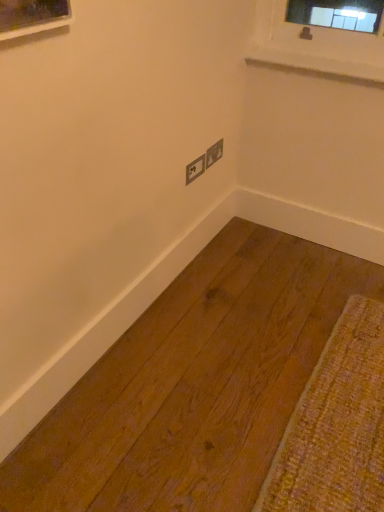
Find the location of a particular element. The width and height of the screenshot is (384, 512). white smooth window sill at upper right is located at coordinates coord(315,64).

You are a GUI agent. You are given a task and a screenshot of the screen. Output one action in this format:
    pyautogui.click(x=<x>, y=<y>)
    Task: Click on the matte gray electrical outlet at center, the first electric outlet positioned from the right
    The height and width of the screenshot is (512, 384).
    Given the screenshot: What is the action you would take?
    pyautogui.click(x=214, y=153)

What is the approximate height of matte gray electrical outlet at center, the first electric outlet positioned from the right?

The height of matte gray electrical outlet at center, the first electric outlet positioned from the right, is 4.01 inches.

Measure the distance between point (187,184) and camera.

Point (187,184) is 5.55 feet from camera.

Identify the location of white smooth window sill at upper right. The width and height of the screenshot is (384, 512). (315, 64).

Is matte gray electric outlet at center, arranged as the second electric outlet when viewed from the right, further to camera compared to white smooth window sill at upper right?

Yes, matte gray electric outlet at center, arranged as the second electric outlet when viewed from the right, is further from the viewer.

From the image's perspective, is matte gray electric outlet at center, arranged as the second electric outlet when viewed from the right, positioned above or below white smooth window sill at upper right?

Clearly, from the image's perspective, matte gray electric outlet at center, arranged as the second electric outlet when viewed from the right, is below white smooth window sill at upper right.

Does point (202, 167) come farther from viewer compared to point (381, 67)?

Yes, it is.

Which of these two, matte gray electric outlet at center, the 1th electric outlet from the left, or white smooth window sill at upper right, is wider?

Wider between the two is white smooth window sill at upper right.

Is white smooth window sill at upper right turned away from matte gray electric outlet at center, arranged as the second electric outlet when viewed from the right?

No, matte gray electric outlet at center, arranged as the second electric outlet when viewed from the right, is not at the back of white smooth window sill at upper right.

Which of these two, white smooth window sill at upper right or matte gray electric outlet at center, arranged as the second electric outlet when viewed from the right, is bigger?

Bigger between the two is white smooth window sill at upper right.

Between white smooth window sill at upper right and matte gray electric outlet at center, arranged as the second electric outlet when viewed from the right, which one has smaller width?

matte gray electric outlet at center, arranged as the second electric outlet when viewed from the right, is thinner.

Is white smooth window sill at upper right surrounding matte gray electric outlet at center, the 1th electric outlet from the left?

No, matte gray electric outlet at center, the 1th electric outlet from the left, is located outside of white smooth window sill at upper right.

Is matte gray electric outlet at center, the 1th electric outlet from the left, placed right next to matte gray electrical outlet at center, acting as the second electric outlet starting from the left?

Yes, matte gray electric outlet at center, the 1th electric outlet from the left, is beside matte gray electrical outlet at center, acting as the second electric outlet starting from the left.

From the image's perspective, is matte gray electric outlet at center, arranged as the second electric outlet when viewed from the right, below matte gray electrical outlet at center, the first electric outlet positioned from the right?

Yes.

Is matte gray electric outlet at center, the 1th electric outlet from the left, surrounding matte gray electrical outlet at center, acting as the second electric outlet starting from the left?

No.

Which is behind, matte gray electric outlet at center, arranged as the second electric outlet when viewed from the right, or matte gray electrical outlet at center, the first electric outlet positioned from the right?

matte gray electrical outlet at center, the first electric outlet positioned from the right, is behind.

Can you confirm if matte gray electrical outlet at center, the first electric outlet positioned from the right, is smaller than matte gray electric outlet at center, the 1th electric outlet from the left?

Yes, matte gray electrical outlet at center, the first electric outlet positioned from the right, is smaller than matte gray electric outlet at center, the 1th electric outlet from the left.

Is matte gray electric outlet at center, arranged as the second electric outlet when viewed from the right, at the back of matte gray electrical outlet at center, acting as the second electric outlet starting from the left?

matte gray electrical outlet at center, acting as the second electric outlet starting from the left, does not have its back to matte gray electric outlet at center, arranged as the second electric outlet when viewed from the right.

From a real-world perspective, is matte gray electrical outlet at center, the first electric outlet positioned from the right, above or below matte gray electric outlet at center, the 1th electric outlet from the left?

From a real-world perspective, matte gray electrical outlet at center, the first electric outlet positioned from the right, is physically above matte gray electric outlet at center, the 1th electric outlet from the left.

Is point (211, 165) in front of point (200, 168)?

No, (211, 165) is behind (200, 168).

Is white smooth window sill at upper right facing away from matte gray electrical outlet at center, acting as the second electric outlet starting from the left?

No, white smooth window sill at upper right is not facing the opposite direction of matte gray electrical outlet at center, acting as the second electric outlet starting from the left.

Is white smooth window sill at upper right situated inside matte gray electrical outlet at center, the first electric outlet positioned from the right, or outside?

white smooth window sill at upper right is not enclosed by matte gray electrical outlet at center, the first electric outlet positioned from the right.

Considering the sizes of objects white smooth window sill at upper right and matte gray electrical outlet at center, the first electric outlet positioned from the right, in the image provided, who is shorter, white smooth window sill at upper right or matte gray electrical outlet at center, the first electric outlet positioned from the right,?

white smooth window sill at upper right.

Is the surface of white smooth window sill at upper right in direct contact with matte gray electrical outlet at center, the first electric outlet positioned from the right?

They are not placed beside each other.

Can you tell me how much matte gray electrical outlet at center, the first electric outlet positioned from the right, and white smooth window sill at upper right differ in facing direction?

92.2 degrees separate the facing orientations of matte gray electrical outlet at center, the first electric outlet positioned from the right, and white smooth window sill at upper right.

From their relative heights in the image, would you say matte gray electrical outlet at center, the first electric outlet positioned from the right, is taller or shorter than white smooth window sill at upper right?

matte gray electrical outlet at center, the first electric outlet positioned from the right, is taller than white smooth window sill at upper right.

Considering their positions, is matte gray electrical outlet at center, the first electric outlet positioned from the right, located in front of or behind white smooth window sill at upper right?

In the image, matte gray electrical outlet at center, the first electric outlet positioned from the right, appears behind white smooth window sill at upper right.

Image resolution: width=384 pixels, height=512 pixels. What are the coordinates of `window sill that is above the matte gray electrical outlet at center, acting as the second electric outlet starting from the left (from the image's perspective)` in the screenshot? It's located at (315, 64).

Identify the location of the 2nd electric outlet directly beneath the white smooth window sill at upper right (from a real-world perspective). Image resolution: width=384 pixels, height=512 pixels. (195, 169).

At what (x,y) coordinates should I click in order to perform the action: click on the 1st electric outlet behind the white smooth window sill at upper right, starting your count from the anchor. Please return your answer as a coordinate pair (x, y). Image resolution: width=384 pixels, height=512 pixels. Looking at the image, I should click on (195, 169).

Consider the image. Which object lies further to the anchor point matte gray electrical outlet at center, acting as the second electric outlet starting from the left, white smooth window sill at upper right or matte gray electric outlet at center, arranged as the second electric outlet when viewed from the right?

white smooth window sill at upper right.

Which object lies nearer to the anchor point matte gray electric outlet at center, the 1th electric outlet from the left, white smooth window sill at upper right or matte gray electrical outlet at center, the first electric outlet positioned from the right?

The object closer to matte gray electric outlet at center, the 1th electric outlet from the left, is matte gray electrical outlet at center, the first electric outlet positioned from the right.

Based on their spatial positions, is matte gray electrical outlet at center, the first electric outlet positioned from the right, or white smooth window sill at upper right further from matte gray electric outlet at center, arranged as the second electric outlet when viewed from the right?

white smooth window sill at upper right lies further to matte gray electric outlet at center, arranged as the second electric outlet when viewed from the right, than the other object.

Estimate the real-world distances between objects in this image. Which object is further from white smooth window sill at upper right, matte gray electrical outlet at center, the first electric outlet positioned from the right, or matte gray electric outlet at center, arranged as the second electric outlet when viewed from the right?

Based on the image, matte gray electric outlet at center, arranged as the second electric outlet when viewed from the right, appears to be further to white smooth window sill at upper right.

Based on their spatial positions, is matte gray electric outlet at center, the 1th electric outlet from the left, or matte gray electrical outlet at center, the first electric outlet positioned from the right, closer to white smooth window sill at upper right?

matte gray electrical outlet at center, the first electric outlet positioned from the right, lies closer to white smooth window sill at upper right than the other object.

Looking at the image, which one is located further to matte gray electrical outlet at center, acting as the second electric outlet starting from the left, matte gray electric outlet at center, the 1th electric outlet from the left, or white smooth window sill at upper right?

white smooth window sill at upper right is further to matte gray electrical outlet at center, acting as the second electric outlet starting from the left.

The width and height of the screenshot is (384, 512). I want to click on electric outlet between matte gray electric outlet at center, arranged as the second electric outlet when viewed from the right, and white smooth window sill at upper right, in the horizontal direction, so click(214, 153).